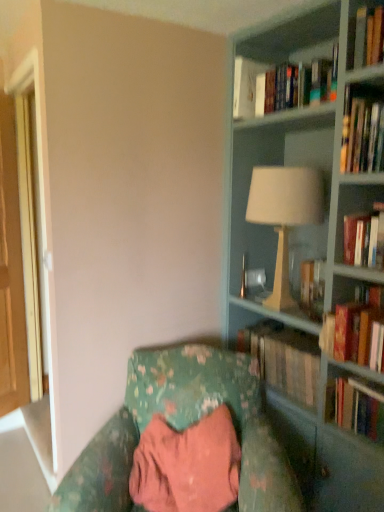
The height and width of the screenshot is (512, 384). What are the coordinates of `white ceramic lamp at upper right` in the screenshot? It's located at (249, 190).

Measure the distance between point (236, 397) and camera.

6.40 feet.

The image size is (384, 512). What do you see at coordinates (354, 325) in the screenshot? I see `hardcover book at right, the third book when ordered from bottom to top` at bounding box center [354, 325].

The image size is (384, 512). Describe the element at coordinates (245, 86) in the screenshot. I see `white paper at upper center, the 5th book in the bottom-to-top sequence` at that location.

From the picture: Measure the distance between hardcover book at center, the second book positioned from the bottom, and camera.

hardcover book at center, the second book positioned from the bottom, is 6.26 feet from camera.

The height and width of the screenshot is (512, 384). What are the coordinates of `matte gray bookcase at right` in the screenshot? It's located at (313, 268).

The image size is (384, 512). I want to click on hardcover books at upper right, which is the 2th book from top to bottom, so click(282, 85).

From the image's perspective, is white paper at upper center, the 5th book in the bottom-to-top sequence, located beneath hardcover book at right, which is the third book from top to bottom?

No, from the image's perspective, white paper at upper center, the 5th book in the bottom-to-top sequence, is not beneath hardcover book at right, which is the third book from top to bottom.

Considering the relative positions of white paper at upper center, acting as the 1th book starting from the top, and hardcover book at right, the third book when ordered from bottom to top, in the image provided, is white paper at upper center, acting as the 1th book starting from the top, behind hardcover book at right, the third book when ordered from bottom to top,?

That is True.

From the picture: Is white paper at upper center, the 5th book in the bottom-to-top sequence, located outside hardcover book at right, which is the third book from top to bottom?

Absolutely, white paper at upper center, the 5th book in the bottom-to-top sequence, is external to hardcover book at right, which is the third book from top to bottom.

Does hardcover book at right, which appears as the first book when ordered from the bottom, lie in front of hardcover book at right, which is the third book from top to bottom?

No, hardcover book at right, which appears as the first book when ordered from the bottom, is behind hardcover book at right, which is the third book from top to bottom.

In the scene shown: Considering the positions of objects hardcover book at right, which appears as the first book when ordered from the bottom, and hardcover book at right, the third book when ordered from bottom to top, in the image provided, who is more to the left, hardcover book at right, which appears as the first book when ordered from the bottom, or hardcover book at right, the third book when ordered from bottom to top,?

hardcover book at right, the third book when ordered from bottom to top.

Considering the sizes of objects hardcover book at right, which appears as the first book when ordered from the bottom, and hardcover book at right, the third book when ordered from bottom to top, in the image provided, who is smaller, hardcover book at right, which appears as the first book when ordered from the bottom, or hardcover book at right, the third book when ordered from bottom to top,?

With smaller size is hardcover book at right, the third book when ordered from bottom to top.

Does point (318, 116) appear closer or farther from the camera than point (283, 387)?

Clearly, point (318, 116) is closer to the camera than point (283, 387).

Is white ceramic lamp at upper right bigger than hardcover book at center, marked as the 4th book in a top-to-bottom arrangement?

Indeed, white ceramic lamp at upper right has a larger size compared to hardcover book at center, marked as the 4th book in a top-to-bottom arrangement.

How far apart are white ceramic lamp at upper right and hardcover book at center, marked as the 4th book in a top-to-bottom arrangement?

white ceramic lamp at upper right is 19.80 inches away from hardcover book at center, marked as the 4th book in a top-to-bottom arrangement.

Is hardcover book at center, the second book positioned from the bottom, in contact with hardcover book at right, which appears as the first book when ordered from the bottom?

No.

Is point (278, 381) behind point (344, 419)?

Yes.

How far apart are hardcover book at center, the second book positioned from the bottom, and hardcover book at right, which appears as the 5th book when viewed from the top?

hardcover book at center, the second book positioned from the bottom, is 11.11 inches from hardcover book at right, which appears as the 5th book when viewed from the top.

Between hardcover book at center, marked as the 4th book in a top-to-bottom arrangement, and brown wooden door at left, which one has smaller size?

With smaller size is brown wooden door at left.

What's the angular difference between hardcover book at center, marked as the 4th book in a top-to-bottom arrangement, and brown wooden door at left's facing directions?

The angular difference between hardcover book at center, marked as the 4th book in a top-to-bottom arrangement, and brown wooden door at left is 118 degrees.

Considering the sizes of objects hardcover book at center, marked as the 4th book in a top-to-bottom arrangement, and brown wooden door at left in the image provided, who is wider, hardcover book at center, marked as the 4th book in a top-to-bottom arrangement, or brown wooden door at left?

Wider between the two is hardcover book at center, marked as the 4th book in a top-to-bottom arrangement.

Considering the relative sizes of hardcover book at center, marked as the 4th book in a top-to-bottom arrangement, and brown wooden door at left in the image provided, is hardcover book at center, marked as the 4th book in a top-to-bottom arrangement, taller than brown wooden door at left?

No.

From a real-world perspective, does hardcover book at center, marked as the 4th book in a top-to-bottom arrangement, sit lower than hardcover books at upper right, the 4th book positioned from the bottom?

Correct, in the physical world, hardcover book at center, marked as the 4th book in a top-to-bottom arrangement, is lower than hardcover books at upper right, the 4th book positioned from the bottom.

Is hardcover book at center, the second book positioned from the bottom, turned away from hardcover books at upper right, the 4th book positioned from the bottom?

No, hardcover book at center, the second book positioned from the bottom, is not facing away from hardcover books at upper right, the 4th book positioned from the bottom.

Is hardcover book at center, the second book positioned from the bottom, placed right next to hardcover books at upper right, which is the 2th book from top to bottom?

No.

Is hardcover book at center, marked as the 4th book in a top-to-bottom arrangement, at the right side of hardcover books at upper right, which is the 2th book from top to bottom?

No, hardcover book at center, marked as the 4th book in a top-to-bottom arrangement, is not to the right of hardcover books at upper right, which is the 2th book from top to bottom.

Would you consider hardcover book at right, which appears as the 5th book when viewed from the top, to be distant from hardcover books at upper right, the 4th book positioned from the bottom?

Absolutely, hardcover book at right, which appears as the 5th book when viewed from the top, is distant from hardcover books at upper right, the 4th book positioned from the bottom.

How many degrees apart are the facing directions of hardcover book at right, which appears as the 5th book when viewed from the top, and hardcover books at upper right, the 4th book positioned from the bottom?

They differ by 0.0998 degrees in their facing directions.

From a real-world perspective, starting from the hardcover book at right, which appears as the first book when ordered from the bottom, which book is the 2nd one vertically above it? Please provide its 2D coordinates.

[(282, 85)]

The width and height of the screenshot is (384, 512). I want to click on the 2nd book above when counting from the hardcover book at right, the third book when ordered from bottom to top (from the image's perspective), so pos(245,86).

You are a GUI agent. You are given a task and a screenshot of the screen. Output one action in this format:
    pyautogui.click(x=<x>, y=<y>)
    Task: Click on the book that is the 1st object directly below the hardcover book at right, which is the third book from top to bottom (from a real-world perspective)
    
    Given the screenshot: What is the action you would take?
    pyautogui.click(x=356, y=406)

Based on the photo, considering their positions, is white paper at upper center, the 5th book in the bottom-to-top sequence, positioned further to brown wooden door at left than white ceramic lamp at upper right?

The object further to brown wooden door at left is white ceramic lamp at upper right.

Considering their positions, is floral fabric chair at lower center positioned further to brown wooden door at left than hardcover book at right, which appears as the 5th book when viewed from the top?

hardcover book at right, which appears as the 5th book when viewed from the top.

Based on their spatial positions, is hardcover book at right, which appears as the first book when ordered from the bottom, or matte gray bookcase at right closer to hardcover book at right, which is the third book from top to bottom?

hardcover book at right, which appears as the first book when ordered from the bottom, is positioned closer to the anchor hardcover book at right, which is the third book from top to bottom.

Estimate the real-world distances between objects in this image. Which object is closer to white paper at upper center, the 5th book in the bottom-to-top sequence, matte gray bookcase at right or floral fabric chair at lower center?

matte gray bookcase at right.

Looking at the image, which one is located further to matte gray bookcase at right, floral fabric chair at lower center or hardcover book at right, which appears as the first book when ordered from the bottom?

floral fabric chair at lower center is positioned further to the anchor matte gray bookcase at right.

When comparing their distances from floral fabric chair at lower center, does hardcover book at right, which is the third book from top to bottom, or matte gray bookcase at right seem closer?

matte gray bookcase at right is positioned closer to the anchor floral fabric chair at lower center.

Considering their positions, is white paper at upper center, acting as the 1th book starting from the top, positioned further to hardcover books at upper right, the 4th book positioned from the bottom, than brown wooden door at left?

Based on the image, brown wooden door at left appears to be further to hardcover books at upper right, the 4th book positioned from the bottom.

Looking at the image, which one is located further to white ceramic lamp at upper right, white paper at upper center, the 5th book in the bottom-to-top sequence, or hardcover book at right, which is the third book from top to bottom?

Based on the image, hardcover book at right, which is the third book from top to bottom, appears to be further to white ceramic lamp at upper right.

Locate an element on the screen. The height and width of the screenshot is (512, 384). bookcase between white ceramic lamp at upper right and hardcover book at right, which appears as the 5th book when viewed from the top, in the up-down direction is located at coordinates (x=313, y=268).

Locate an element on the screen. Image resolution: width=384 pixels, height=512 pixels. bookcase that lies between white paper at upper center, the 5th book in the bottom-to-top sequence, and hardcover book at right, which appears as the first book when ordered from the bottom, from top to bottom is located at coordinates (313, 268).

Where is `bookcase between hardcover books at upper right, which is the 2th book from top to bottom, and hardcover book at right, which appears as the first book when ordered from the bottom, from top to bottom`? bookcase between hardcover books at upper right, which is the 2th book from top to bottom, and hardcover book at right, which appears as the first book when ordered from the bottom, from top to bottom is located at coordinates (313, 268).

You are a GUI agent. You are given a task and a screenshot of the screen. Output one action in this format:
    pyautogui.click(x=<x>, y=<y>)
    Task: Click on the book between white ceramic lamp at upper right and hardcover book at center, the second book positioned from the bottom, vertically
    The height and width of the screenshot is (512, 384).
    Given the screenshot: What is the action you would take?
    pyautogui.click(x=354, y=325)